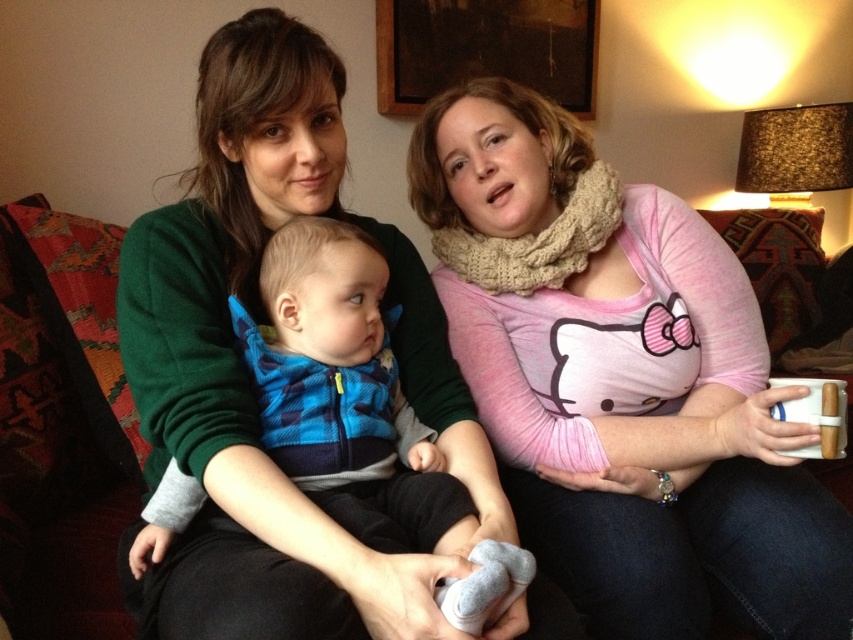
You are a photographer setting up a shoot in this living room. You need to decide which object, the pink knit scarf at upper right or the blue fleece vest at center, will require a higher camera angle to capture fully in the photo. Which one?

The pink knit scarf at upper right has a greater height compared to the blue fleece vest at center, so you will need a higher camera angle to capture the pink knit scarf at upper right fully in the photo.